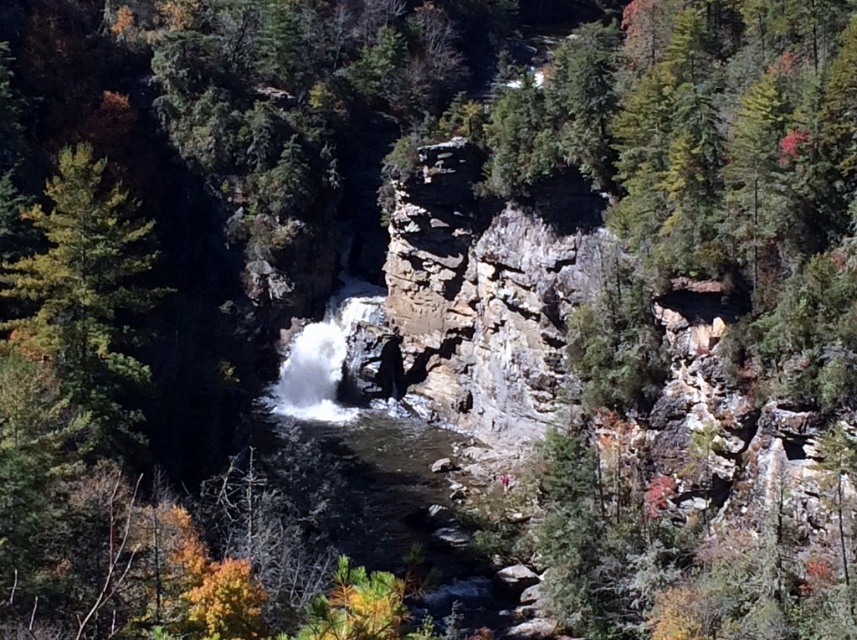
You are a hiker standing at the base of the cliff. You see a green matte tree at left and white frothy water at center. Which object is higher up in the scene?

The green matte tree at left is located above the white frothy water at center, so the green matte tree at left is higher up in the scene.

You are standing at the base of the cliff and want to take a photo of both the green matte tree at left and the white frothy water at center. Which object should you focus on first to ensure it appears sharp in your photo?

You should focus on the green matte tree at left first because it is closer to the viewer than the white frothy water at center, so focusing on the closer object ensures it will be sharp, and the background may still be in acceptable focus depending on your camera settings.

You are standing at the base of the cliff near the waterfall and want to determine which of the two points, point (94, 205) or point (324, 358), is closer to you. Based on the image, which point is nearer?

Point (94, 205) is closer to the viewer than point (324, 358).